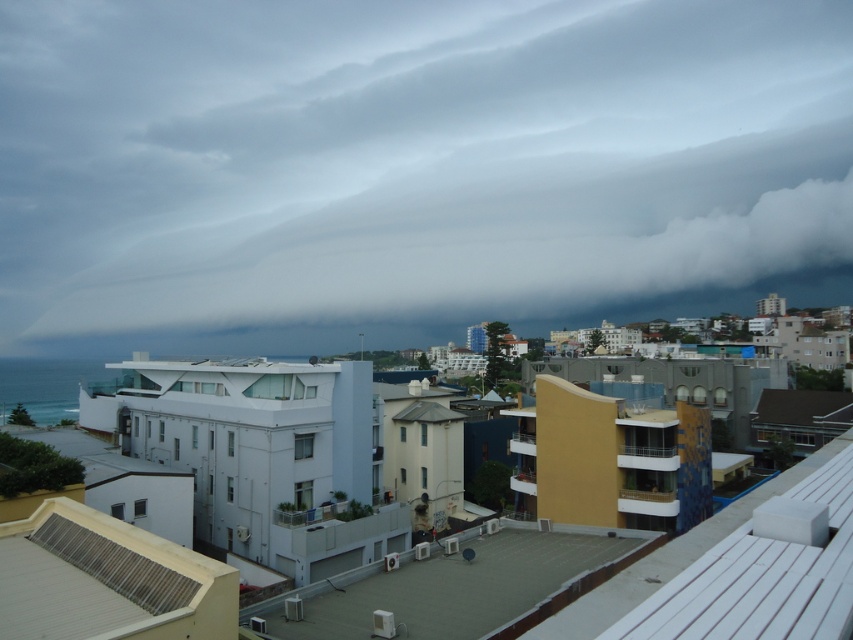
Between gray cloud at upper center and white concrete balcony at center, which one has less height?

white concrete balcony at center

Is point (56, 337) positioned in front of point (364, 531)?

No, it is not.

Find the location of `gray cloud at upper center`. gray cloud at upper center is located at coordinates (410, 170).